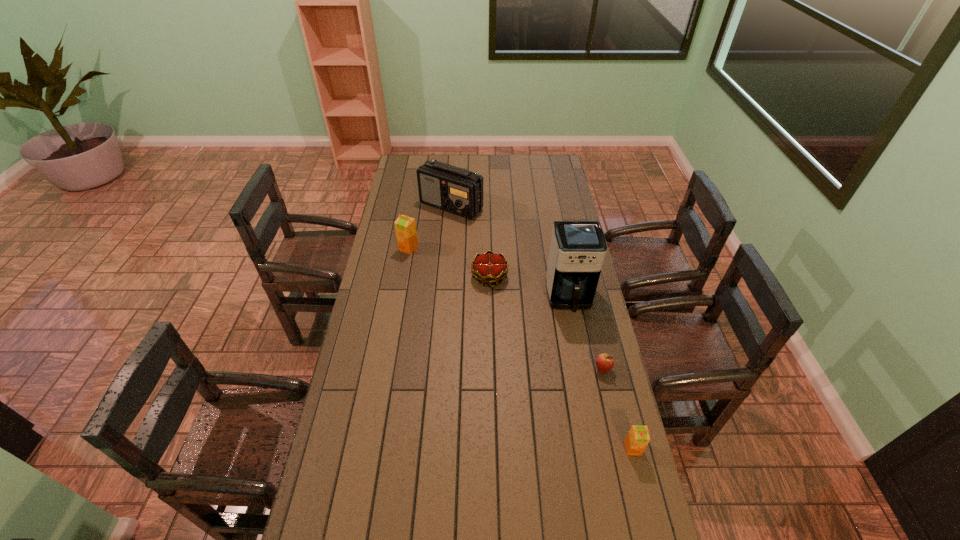
You are a GUI agent. You are given a task and a screenshot of the screen. Output one action in this format:
    pyautogui.click(x=<x>, y=<y>)
    Task: Click on the fourth shortest object
    
    Given the screenshot: What is the action you would take?
    pyautogui.click(x=405, y=227)

Where is `the taller orange juice`? The width and height of the screenshot is (960, 540). the taller orange juice is located at coordinates (405, 227).

This screenshot has height=540, width=960. I want to click on the shorter orange juice, so click(x=638, y=437).

Locate an element on the screen. This screenshot has height=540, width=960. the nearer orange juice is located at coordinates 638,437.

Image resolution: width=960 pixels, height=540 pixels. In order to click on the farthest object in this screenshot , I will do `click(456, 190)`.

At what (x,y) coordinates should I click in order to perform the action: click on radio receiver. Please return your answer as a coordinate pair (x, y). This screenshot has height=540, width=960. Looking at the image, I should click on (456, 190).

Where is `the tallest object`? Image resolution: width=960 pixels, height=540 pixels. the tallest object is located at coordinates coord(577,250).

Find the location of a particular element. crown is located at coordinates (488, 268).

Image resolution: width=960 pixels, height=540 pixels. I want to click on the fifth farthest object, so click(604, 362).

This screenshot has height=540, width=960. Identify the location of free space located 0.200m on the back of the second farthest object. (415, 215).